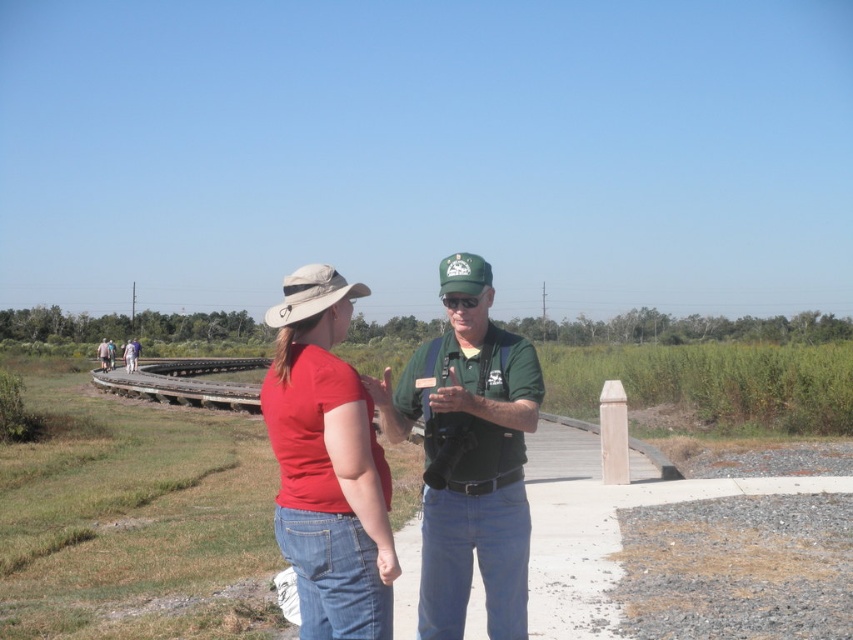
Question: Can you confirm if green fabric shirt at center is bigger than matte red shirt at left?

Choices:
 (A) no
 (B) yes

Answer: (A)

Question: Which point is farther from the camera taking this photo?

Choices:
 (A) (447, 269)
 (B) (294, 276)

Answer: (A)

Question: Which point appears closest to the camera in this image?

Choices:
 (A) (317, 467)
 (B) (310, 278)
 (C) (123, 352)
 (D) (477, 513)

Answer: (A)

Question: Which of the following is the closest to the observer?

Choices:
 (A) matte red shirt at center
 (B) green fabric baseball cap at center
 (C) khaki fabric baseball hat at center
 (D) green fabric shirt at center

Answer: (A)

Question: Can you confirm if matte red shirt at center is positioned to the left of khaki fabric baseball hat at center?

Choices:
 (A) yes
 (B) no

Answer: (B)

Question: In this image, where is matte red shirt at center located relative to green fabric baseball cap at center?

Choices:
 (A) below
 (B) above

Answer: (A)